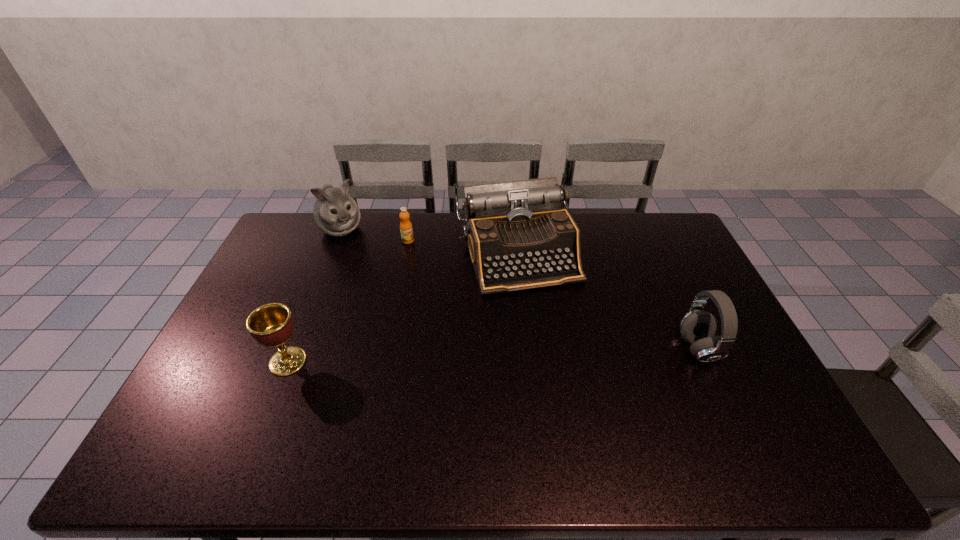
Find the location of a particular element. Image resolution: width=960 pixels, height=540 pixels. free point between the chalice and the second object from right to left is located at coordinates (402, 308).

You are a GUI agent. You are given a task and a screenshot of the screen. Output one action in this format:
    pyautogui.click(x=<x>, y=<y>)
    Task: Click on the free area in between the orange juice and the headset
    
    Given the screenshot: What is the action you would take?
    pyautogui.click(x=553, y=295)

Locate an element on the screen. vacant region between the chalice and the typewriter is located at coordinates (402, 308).

This screenshot has width=960, height=540. What are the coordinates of `unoccupied position between the orange juice and the headset` in the screenshot? It's located at (553, 295).

Where is `vacant space that is in between the chalice and the hamster`? vacant space that is in between the chalice and the hamster is located at coordinates (315, 295).

This screenshot has height=540, width=960. What are the coordinates of `free area in between the fourth object from left to right and the third object from right to left` in the screenshot? It's located at (462, 247).

Identify the location of empty space between the third object from right to left and the hamster. (374, 234).

This screenshot has height=540, width=960. In order to click on vacant area that lies between the headset and the typewriter in this screenshot , I will do `click(607, 302)`.

Image resolution: width=960 pixels, height=540 pixels. Identify the location of the closest object relative to the second object from right to left. click(x=406, y=230).

Locate an element on the screen. The height and width of the screenshot is (540, 960). object that is the fourth closest one to the rightmost object is located at coordinates (335, 213).